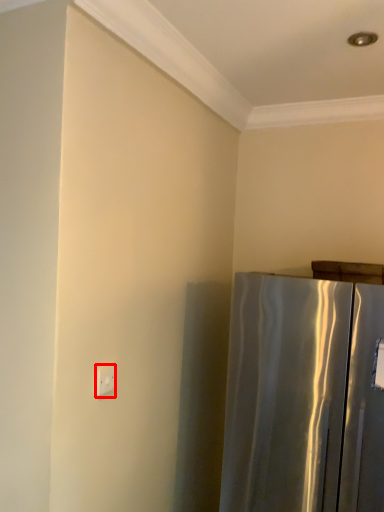
Question: Considering the relative positions of electric outlet (annotated by the red box) and refrigerator in the image provided, where is electric outlet (annotated by the red box) located with respect to the staircase?

Choices:
 (A) left
 (B) right

Answer: (A)